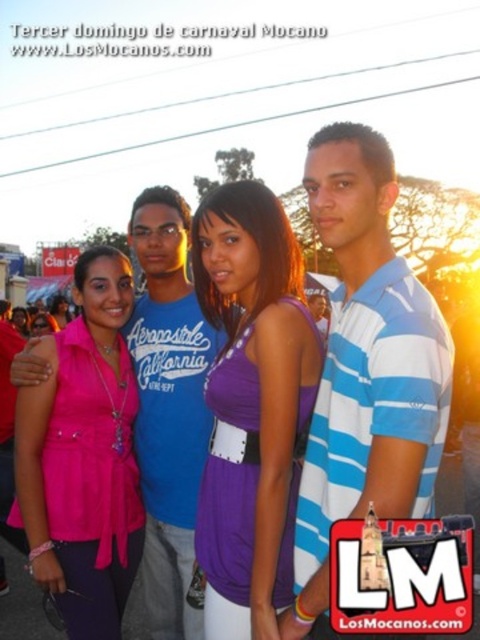
Question: Considering the real-world distances, which object is farthest from the pink fabric top at center?

Choices:
 (A) pink fabric shirt at center
 (B) blue striped polo shirt at center
 (C) purple fabric dress at center
 (D) matte pink blouse at center

Answer: (B)

Question: Which of the following is the farthest from the observer?

Choices:
 (A) (76, 269)
 (B) (358, 460)
 (C) (63, 298)

Answer: (C)

Question: Does blue striped polo shirt at center appear under matte pink blouse at center?

Choices:
 (A) yes
 (B) no

Answer: (B)

Question: Is purple fabric dress at center closer to the viewer compared to pink fabric shirt at center?

Choices:
 (A) no
 (B) yes

Answer: (B)

Question: Can you confirm if blue striped polo shirt at center is smaller than purple fabric dress at center?

Choices:
 (A) yes
 (B) no

Answer: (B)

Question: Which of the following is the farthest from the observer?

Choices:
 (A) (54, 301)
 (B) (288, 355)
 (C) (27, 324)
 (D) (76, 637)

Answer: (A)